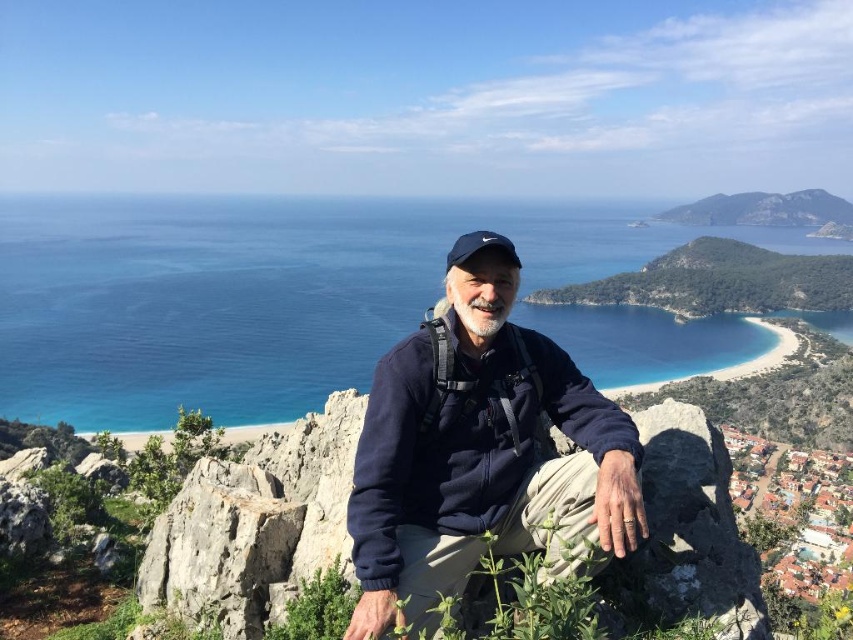
Question: Which of the following is the farthest from the observer?

Choices:
 (A) (450, 348)
 (B) (222, 593)

Answer: (A)

Question: Does rugged stone cliff at center appear on the left side of green leafy hill at upper right?

Choices:
 (A) no
 (B) yes

Answer: (B)

Question: Which of these objects is positioned closest to the navy blue fleece at center?

Choices:
 (A) green leafy hill at center right
 (B) green leafy hill at upper right
 (C) rugged stone cliff at center

Answer: (C)

Question: Among these objects, which one is farthest from the camera?

Choices:
 (A) green leafy hill at upper right
 (B) rugged stone cliff at center
 (C) green leafy hill at center right

Answer: (A)

Question: Is rugged stone cliff at center to the right of green leafy hill at upper right from the viewer's perspective?

Choices:
 (A) yes
 (B) no

Answer: (B)

Question: Is navy blue fleece at center to the left of green leafy hill at upper right from the viewer's perspective?

Choices:
 (A) no
 (B) yes

Answer: (B)